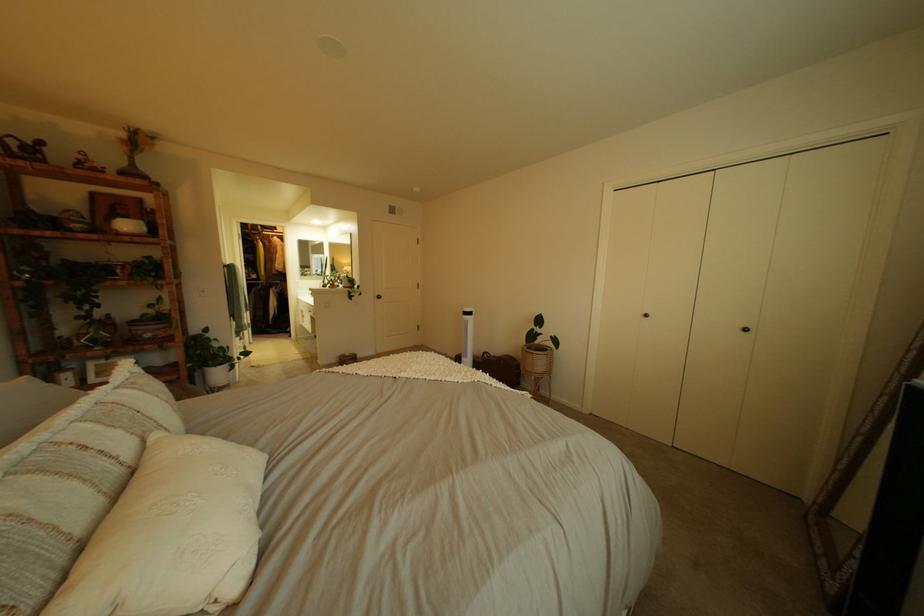
Which object does [211,360] point to?

This point indicates the small flower vase.